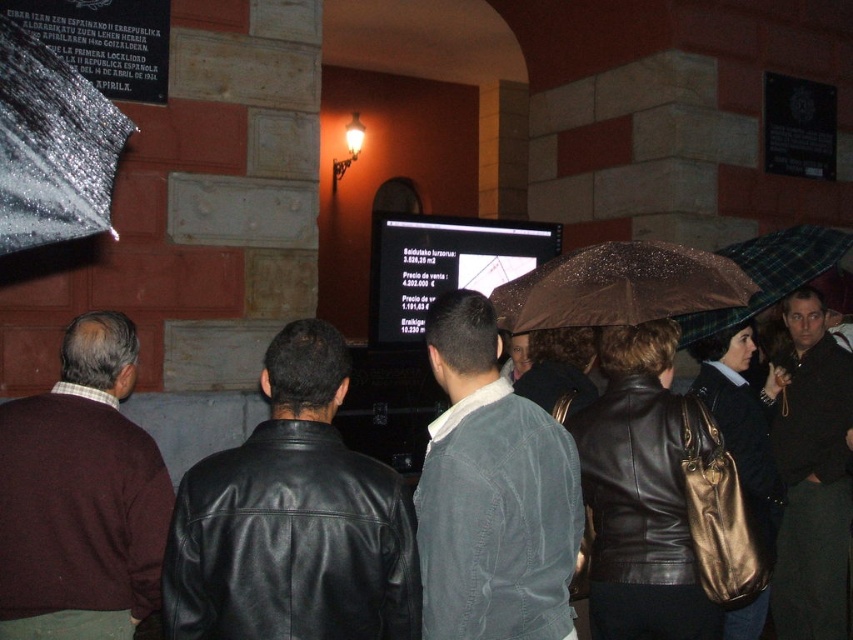
Is dark gray corduroy jacket at center thinner than shiny metallic umbrella at upper left?

No, dark gray corduroy jacket at center is not thinner than shiny metallic umbrella at upper left.

Does dark gray corduroy jacket at center have a greater width compared to shiny metallic umbrella at upper left?

Indeed, dark gray corduroy jacket at center has a greater width compared to shiny metallic umbrella at upper left.

Does point (456, 556) come farther from viewer compared to point (26, 33)?

Yes, point (456, 556) is behind point (26, 33).

Where is `dark gray corduroy jacket at center`? The height and width of the screenshot is (640, 853). dark gray corduroy jacket at center is located at coordinates (492, 493).

How much distance is there between dark gray corduroy jacket at center and brown shiny umbrella at center?

4.65 feet

Can you confirm if dark gray corduroy jacket at center is shorter than brown shiny umbrella at center?

No, dark gray corduroy jacket at center is not shorter than brown shiny umbrella at center.

Who is more distant from viewer, (x=474, y=394) or (x=630, y=269)?

Positioned behind is point (x=630, y=269).

Locate an element on the screen. dark gray corduroy jacket at center is located at coordinates (492, 493).

Who is more distant from viewer, (495,358) or (757,285)?

The point (757,285) is behind.

Does point (430, 582) come closer to viewer compared to point (752, 316)?

That is True.

You are a GUI agent. You are given a task and a screenshot of the screen. Output one action in this format:
    pyautogui.click(x=<x>, y=<y>)
    Task: Click on the dark gray corduroy jacket at center
    Image resolution: width=853 pixels, height=640 pixels.
    Given the screenshot: What is the action you would take?
    pyautogui.click(x=492, y=493)